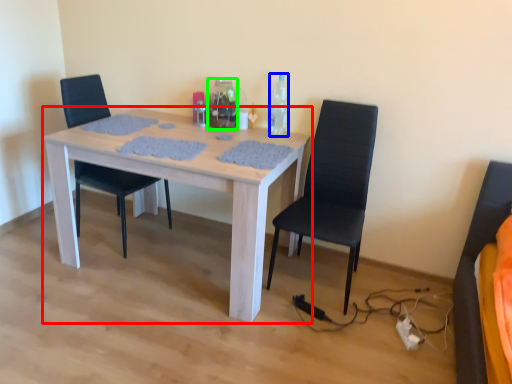
Question: Estimate the real-world distances between objects in this image. Which object is farther from kitchen & dining room table (highlighted by a red box), bottle (highlighted by a blue box) or bottle (highlighted by a green box)?

Choices:
 (A) bottle
 (B) bottle

Answer: (A)